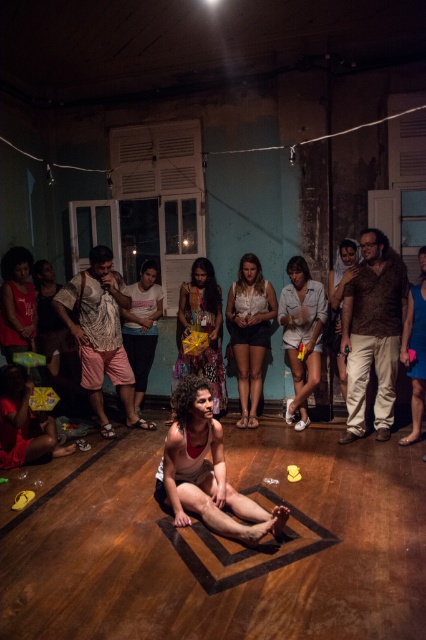
Question: Which point is farther to the camera?

Choices:
 (A) matte white shirt at center
 (B) matte red tank top at left
 (C) multicolored fabric bag at center

Answer: (A)

Question: Which object is closer to the camera taking this photo?

Choices:
 (A) matte white shirt at center
 (B) light blue denim shorts at center
 (C) white matte shirt at center
 (D) matte brown dress at center

Answer: (D)

Question: Considering the relative positions of white matte shirt at center and matte brown dress at center in the image provided, where is white matte shirt at center located with respect to matte brown dress at center?

Choices:
 (A) above
 (B) below

Answer: (A)

Question: Which point appears closest to the camera in this image?

Choices:
 (A) (416, 356)
 (B) (204, 291)

Answer: (A)

Question: Can you confirm if patterned fabric shirt at center is positioned to the left of multicolored fabric bag at center?

Choices:
 (A) no
 (B) yes

Answer: (B)

Question: Can you confirm if brown furry shirt at right is positioned to the right of matte red tank top at left?

Choices:
 (A) no
 (B) yes

Answer: (B)